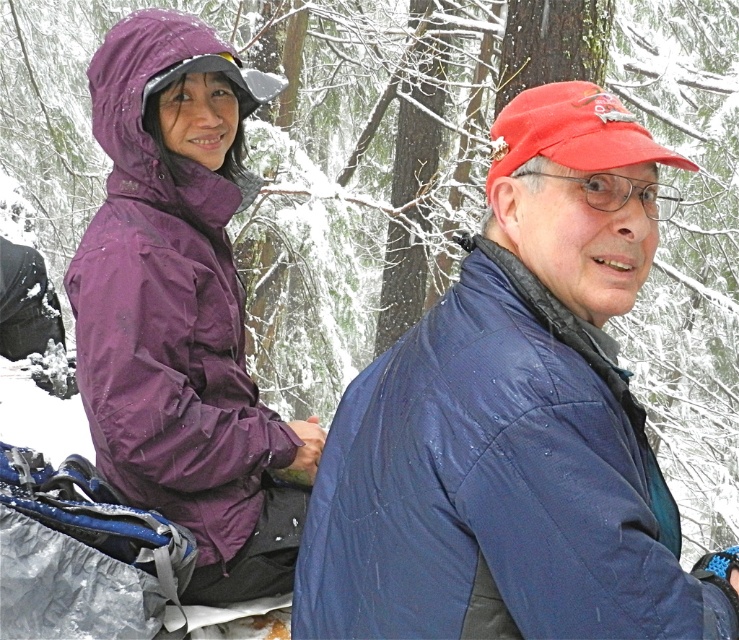
The width and height of the screenshot is (739, 640). I want to click on blue quilted jacket at right, so click(x=517, y=420).

Between point (500, 120) and point (146, 332), which one is positioned behind?

Positioned behind is point (146, 332).

Identify the location of blue quilted jacket at right. This screenshot has width=739, height=640. (517, 420).